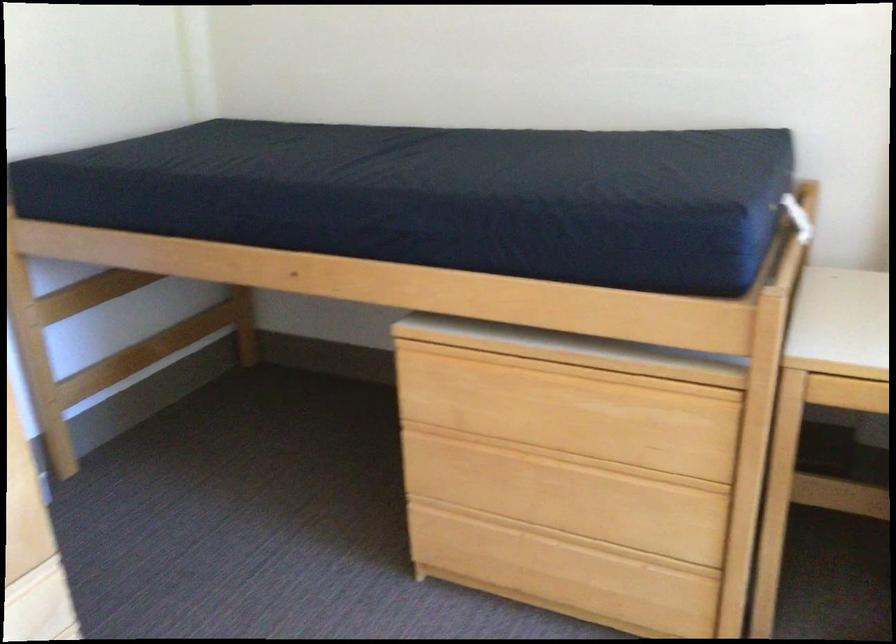
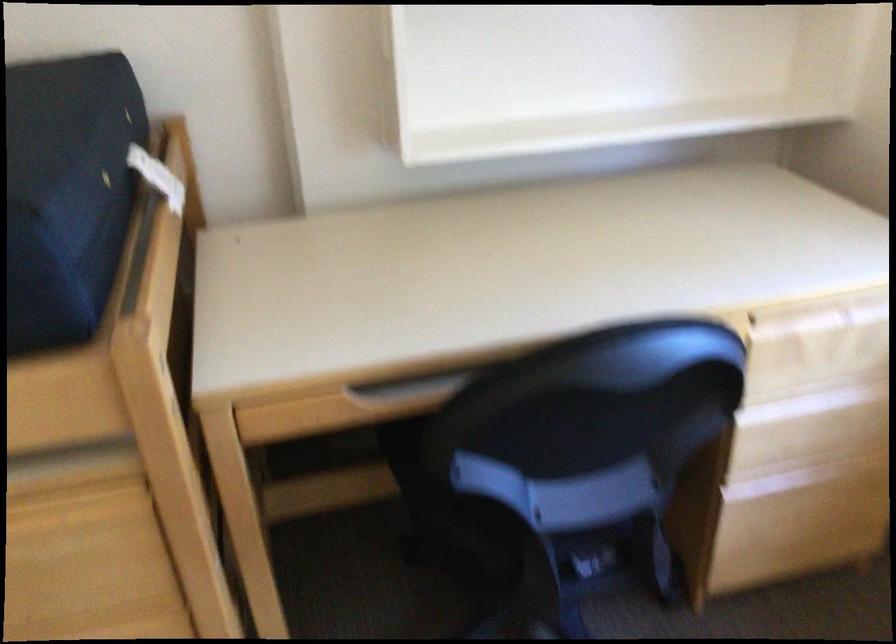
Question: The images are taken continuously from a first-person perspective. In which direction is your viewpoint rotating?

Choices:
 (A) Left
 (B) Right
 (C) Up
 (D) Down

Answer: (B)